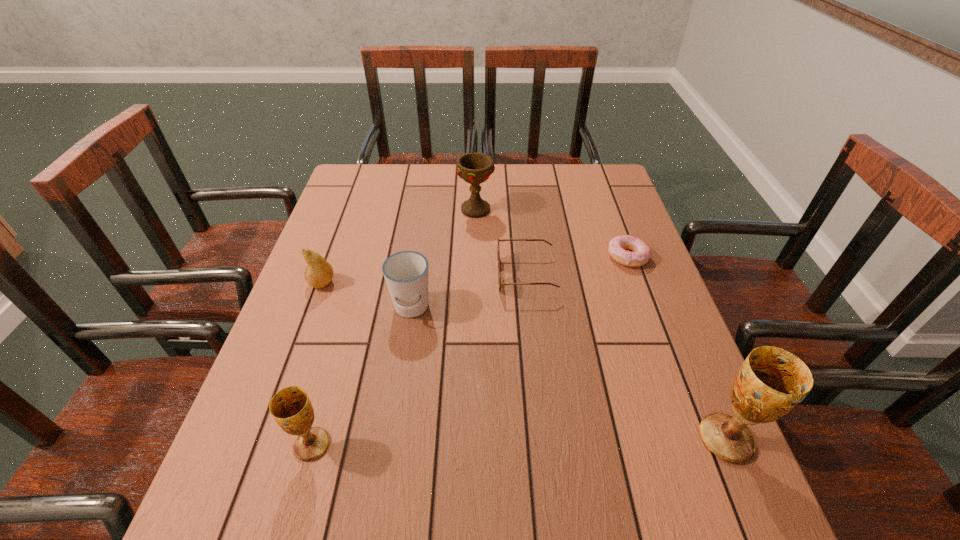
Identify the location of location for an additional chalice to make spacing equal. This screenshot has width=960, height=540. (520, 442).